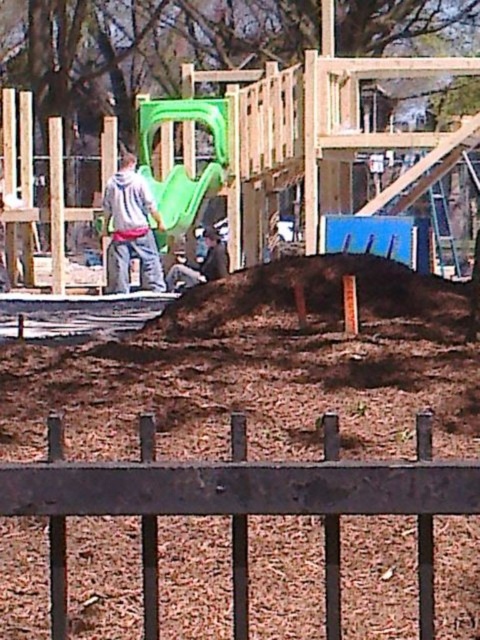
Question: Which of the following is the farthest from the observer?

Choices:
 (A) (400, 310)
 (B) (57, 500)

Answer: (A)

Question: Which point appears closest to the camera in this image?

Choices:
 (A) (240, 636)
 (B) (444, 320)

Answer: (A)

Question: Which object appears farthest from the camera in this image?

Choices:
 (A) black wrought iron fence at lower center
 (B) brown mulch at center

Answer: (B)

Question: Does black wrought iron fence at lower center have a larger size compared to brown mulch at center?

Choices:
 (A) yes
 (B) no

Answer: (B)

Question: Is black wrought iron fence at lower center smaller than brown mulch at center?

Choices:
 (A) yes
 (B) no

Answer: (A)

Question: Does black wrought iron fence at lower center have a lesser width compared to brown mulch at center?

Choices:
 (A) no
 (B) yes

Answer: (B)